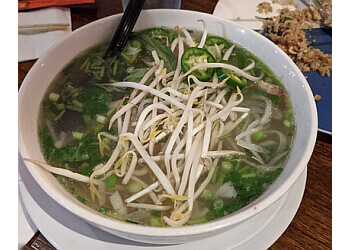
I want to click on chopstick, so click(x=37, y=27).